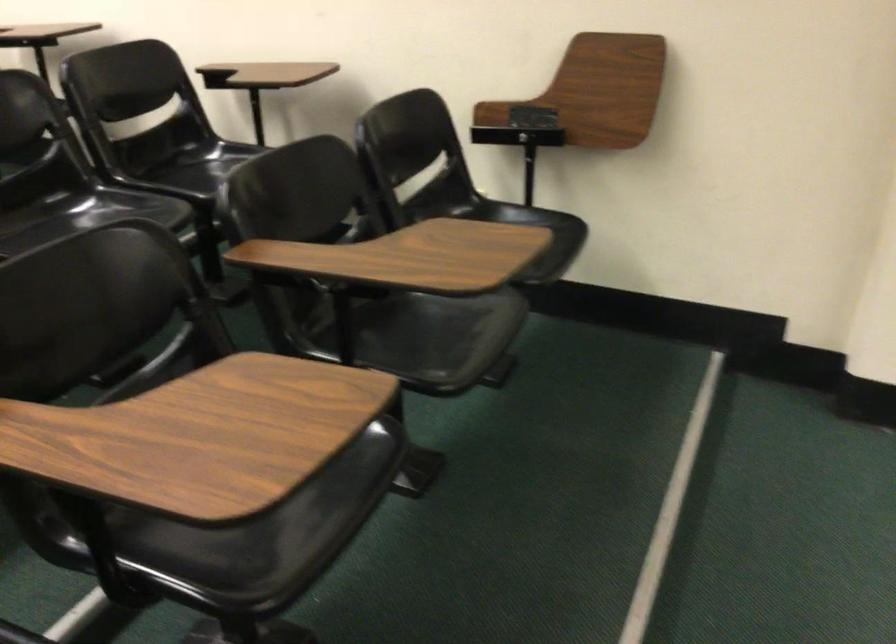
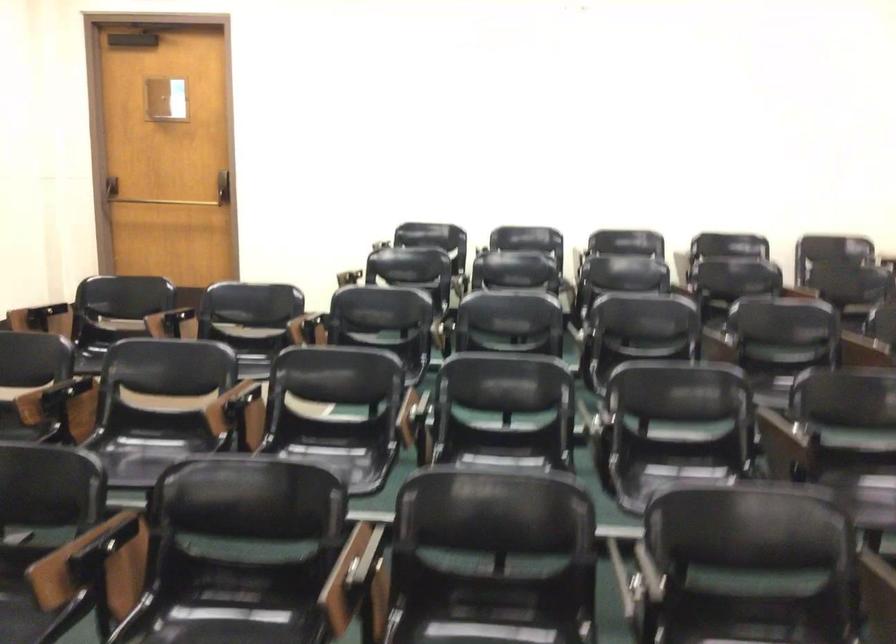
Question: The camera is either moving clockwise (left) or counter-clockwise (right) around the object. The first image is from the beginning of the video and the second image is from the end. Is the camera moving left or right when shooting the video?

Choices:
 (A) Left
 (B) Right

Answer: (B)